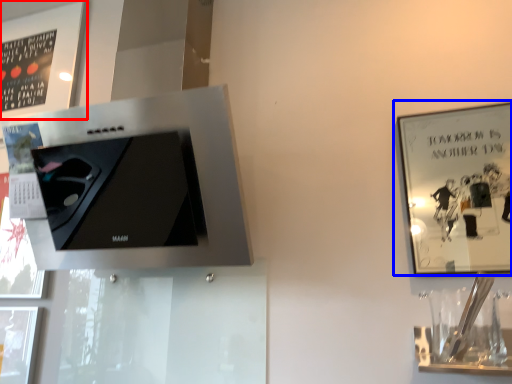
Question: Which point is further to the camera, picture frame (highlighted by a red box) or picture frame (highlighted by a blue box)?

Choices:
 (A) picture frame
 (B) picture frame

Answer: (A)